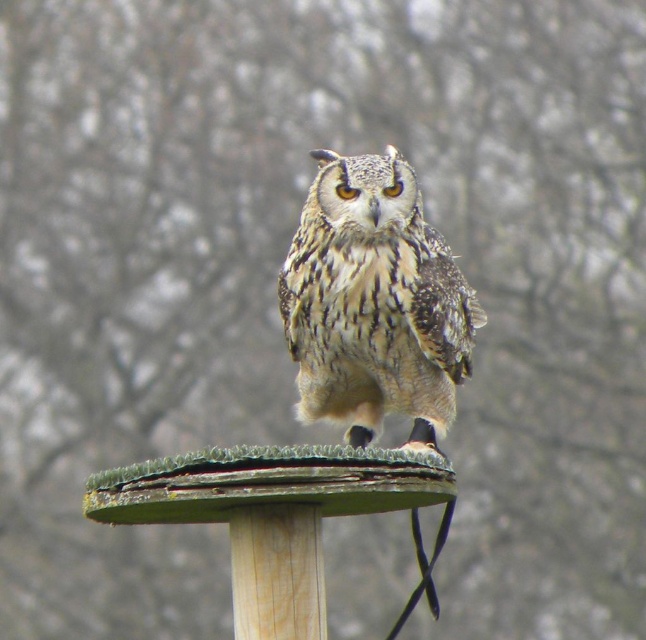
Which is above, green plastic bird feeder at center or wooden post at center?

green plastic bird feeder at center is higher up.

Does green plastic bird feeder at center appear on the right side of wooden post at center?

No, green plastic bird feeder at center is not to the right of wooden post at center.

Between point (335, 467) and point (307, 544), which one is positioned behind?

The point (307, 544) is more distant.

Where is `green plastic bird feeder at center`? green plastic bird feeder at center is located at coordinates (280, 492).

Consider the image. Who is shorter, speckled feathered owl at center or green plastic bird feeder at center?

green plastic bird feeder at center is shorter.

Does speckled feathered owl at center have a greater height compared to green plastic bird feeder at center?

Correct, speckled feathered owl at center is much taller as green plastic bird feeder at center.

Is point (357, 209) farther from camera compared to point (435, 481)?

Yes, it is.

You are a GUI agent. You are given a task and a screenshot of the screen. Output one action in this format:
    pyautogui.click(x=<x>, y=<y>)
    Task: Click on the speckled feathered owl at center
    
    Given the screenshot: What is the action you would take?
    pyautogui.click(x=373, y=301)

Who is positioned more to the right, speckled feathered owl at center or wooden post at center?

From the viewer's perspective, speckled feathered owl at center appears more on the right side.

Is point (386, 403) closer to viewer compared to point (234, 516)?

No, it is behind (234, 516).

What do you see at coordinates (373, 301) in the screenshot? I see `speckled feathered owl at center` at bounding box center [373, 301].

Locate an element on the screen. This screenshot has width=646, height=640. speckled feathered owl at center is located at coordinates (373, 301).